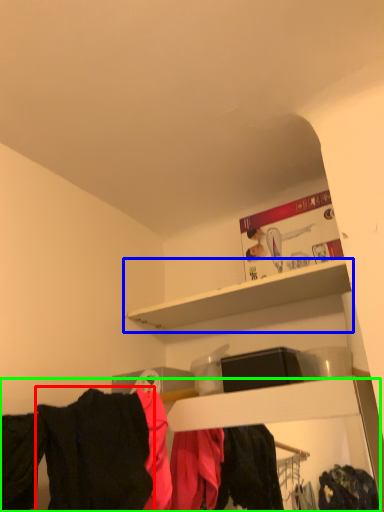
Question: Which is nearer to the clothing (highlighted by a red box)? shelf (highlighted by a blue box) or closet (highlighted by a green box).

Choices:
 (A) shelf
 (B) closet

Answer: (B)